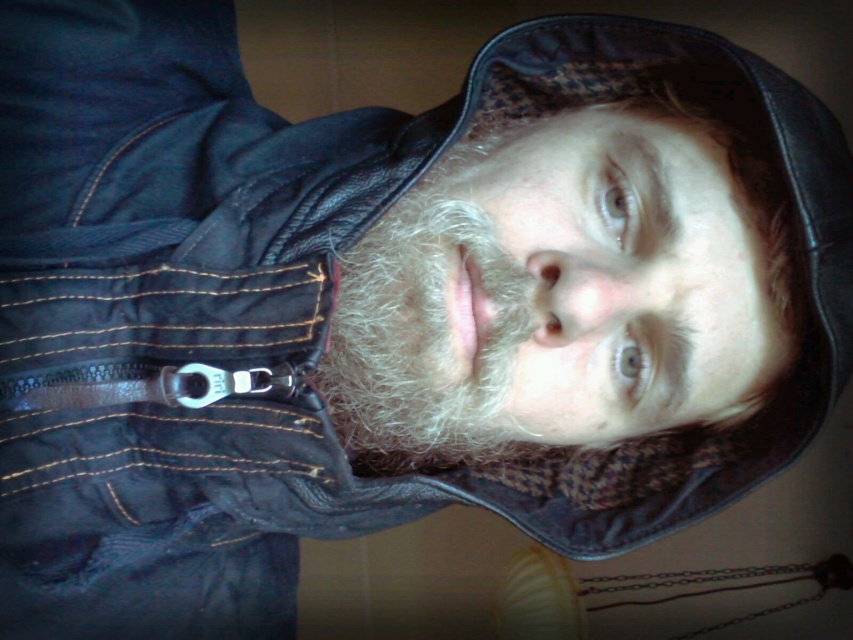
You are a photographer adjusting the lighting for a portrait. You notice the light brown textured hair at center and the white fuzzy beard at center. Which of these features is closer to the camera?

The light brown textured hair at center is closer to the camera because it is in front of the white fuzzy beard at center.

You are a photographer adjusting your camera settings to capture the person in the scene. The camera focuses on the point marked as point (567, 280). Based on the scene description, where is the light brown textured hair located relative to the person?

The light brown textured hair at center is represented by point (567, 280), so it is located at the center of the person.

Looking at the person in the image, which of the following is taller between the light brown textured hair at center and the white fuzzy beard at center?

The light brown textured hair at center is taller than the white fuzzy beard at center.